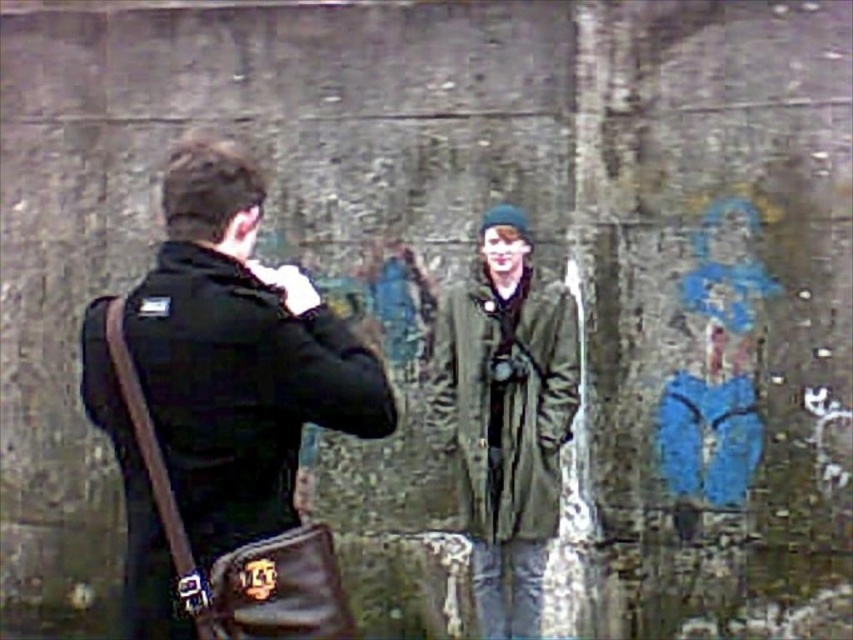
You are standing in the urban setting shown in the image and want to place a small sticker exactly halfway between the point at coordinates point (369, 385) and the point at coordinates point (457, 413). Will the sticker be closer to the viewer or farther away compared to the two points?

The sticker placed halfway between point (369, 385) and point (457, 413) will be closer to the viewer than point (457, 413) but farther than point (369, 385). However, since point (369, 385) is already closer to the viewer than point (457, 413), the midpoint will be positioned between their distances. But according to the given description, the sticker would be at the average of their coordinates. Since the z depth isn not provided, we can infer based on the given spatial relation that the first

You are a photographer standing in an urban setting with a subject. You notice a black leather bag at left and an olive green textured jacket at center. Which object is nearer to you?

The black leather bag at left is closer to the viewer than the olive green textured jacket at center.

You are a photographer standing in an urban setting with a subject. You notice a black leather bag at left and an olive green textured jacket at center. Which object is positioned closer to the left side of the frame?

The black leather bag at left is positioned to the left of the olive green textured jacket at center, so it is closer to the left side of the frame.